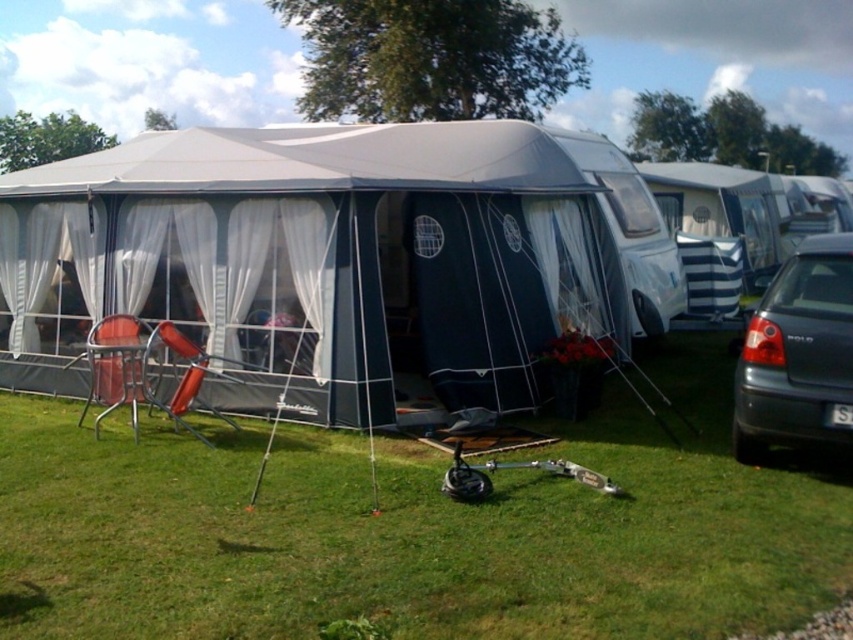
Between green grass at lower center and dark gray metallic car at right, which one appears on the right side from the viewer's perspective?

dark gray metallic car at right is more to the right.

Can you confirm if green grass at lower center is smaller than dark gray metallic car at right?

Yes.

Which is behind, point (764, 625) or point (846, 253)?

Point (846, 253)

You are a GUI agent. You are given a task and a screenshot of the screen. Output one action in this format:
    pyautogui.click(x=<x>, y=<y>)
    Task: Click on the green grass at lower center
    The height and width of the screenshot is (640, 853).
    Given the screenshot: What is the action you would take?
    pyautogui.click(x=415, y=529)

Can you confirm if matte gray tent at center is smaller than dark gray metallic car at right?

Incorrect, matte gray tent at center is not smaller in size than dark gray metallic car at right.

Is point (442, 163) less distant than point (752, 419)?

No, (442, 163) is further to viewer.

The height and width of the screenshot is (640, 853). I want to click on matte gray tent at center, so click(321, 259).

Does point (106, 496) come farther from viewer compared to point (273, 134)?

No.

What do you see at coordinates (415, 529) in the screenshot?
I see `green grass at lower center` at bounding box center [415, 529].

Which is in front, point (662, 512) or point (106, 160)?

Point (662, 512)

Find the location of a particular element. Image resolution: width=853 pixels, height=640 pixels. green grass at lower center is located at coordinates (415, 529).